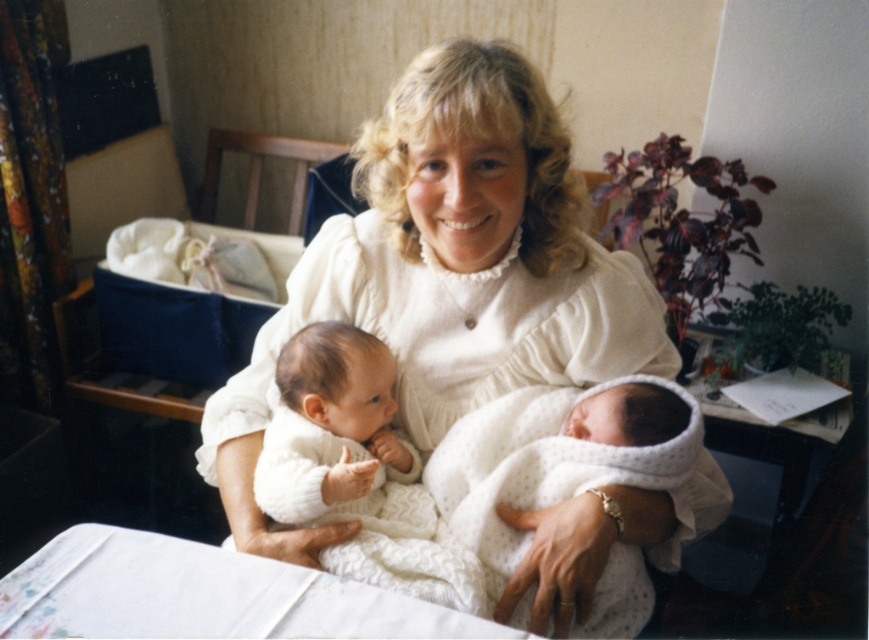
Looking at this image, does white knitted blanket at center appear under white knitted sweater at center?

Correct, white knitted blanket at center is located below white knitted sweater at center.

Does point (629, 604) come behind point (294, 435)?

No, it is in front of (294, 435).

Which is behind, point (634, 605) or point (294, 355)?

Point (294, 355)

You are a GUI agent. You are given a task and a screenshot of the screen. Output one action in this format:
    pyautogui.click(x=<x>, y=<y>)
    Task: Click on the white knitted blanket at center
    
    Given the screenshot: What is the action you would take?
    pyautogui.click(x=556, y=458)

Does white knitted dress at center have a greater height compared to white knitted sweater at center?

Yes.

Is white knitted dress at center wider than white knitted sweater at center?

Yes.

Does point (635, 300) lie in front of point (282, 365)?

Yes, it is.

In order to click on white knitted dress at center in this screenshot , I will do `click(449, 273)`.

Can you confirm if white knitted dress at center is bigger than white knitted blanket at center?

Indeed, white knitted dress at center has a larger size compared to white knitted blanket at center.

This screenshot has height=640, width=869. In order to click on white knitted dress at center in this screenshot , I will do `click(449, 273)`.

The height and width of the screenshot is (640, 869). What do you see at coordinates (449, 273) in the screenshot? I see `white knitted dress at center` at bounding box center [449, 273].

Where is `white knitted dress at center`? white knitted dress at center is located at coordinates pos(449,273).